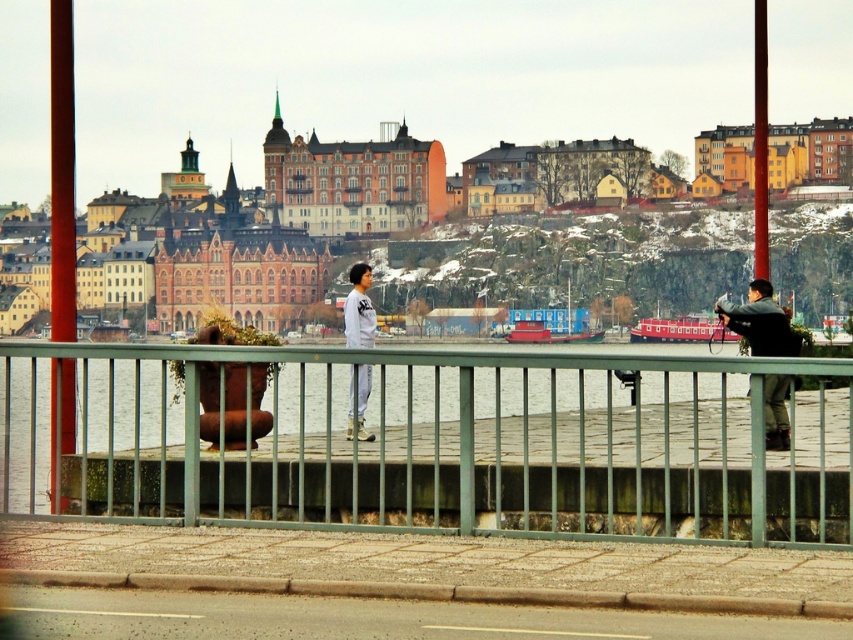
Question: Which object is closer to the camera taking this photo?

Choices:
 (A) white matte jacket at center
 (B) green metal fence at center
 (C) dark gray jacket at right

Answer: (B)

Question: Which of the following is the farthest from the observer?

Choices:
 (A) (788, 381)
 (B) (407, 448)
 (C) (363, 340)

Answer: (C)

Question: Is green metal fence at center positioned before dark gray jacket at right?

Choices:
 (A) no
 (B) yes

Answer: (B)

Question: Which point is farther to the camera?

Choices:
 (A) (334, 372)
 (B) (364, 337)
 (C) (717, 308)

Answer: (C)

Question: Is green metal fence at center thinner than dark gray jacket at right?

Choices:
 (A) no
 (B) yes

Answer: (A)

Question: Is green metal fence at center to the right of white matte jacket at center from the viewer's perspective?

Choices:
 (A) yes
 (B) no

Answer: (A)